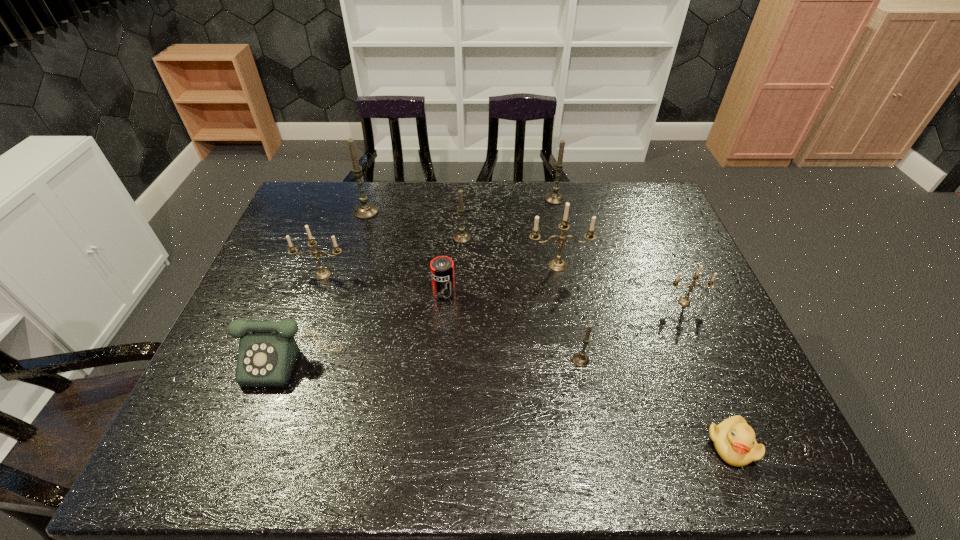
The height and width of the screenshot is (540, 960). Find the location of `gray candle that is the closest to the smallest gray candle`. gray candle that is the closest to the smallest gray candle is located at coordinates (461, 237).

Select which metallic candle appears as the closest to the nearest object. Please provide its 2D coordinates. Your answer should be formatted as a tuple, i.e. [(x, y)], where the tuple contains the x and y coordinates of a point satisfying the conditions above.

[(685, 301)]

Identify which metallic candle is the nearest to the can. Please provide its 2D coordinates. Your answer should be formatted as a tuple, i.e. [(x, y)], where the tuple contains the x and y coordinates of a point satisfying the conditions above.

[(557, 265)]

You are a GUI agent. You are given a task and a screenshot of the screen. Output one action in this format:
    pyautogui.click(x=<x>, y=<y>)
    Task: Click on the free space that satisfies the following two spatial constraints: 1. on the dial of the telephone; 2. on the right side of the smallest gray candle
    The height and width of the screenshot is (540, 960).
    Given the screenshot: What is the action you would take?
    pyautogui.click(x=291, y=360)

This screenshot has height=540, width=960. In order to click on free location that satisfies the following two spatial constraints: 1. on the back side of the second metallic candle from right to left; 2. on the right side of the leftmost metallic candle in this screenshot , I will do `click(326, 266)`.